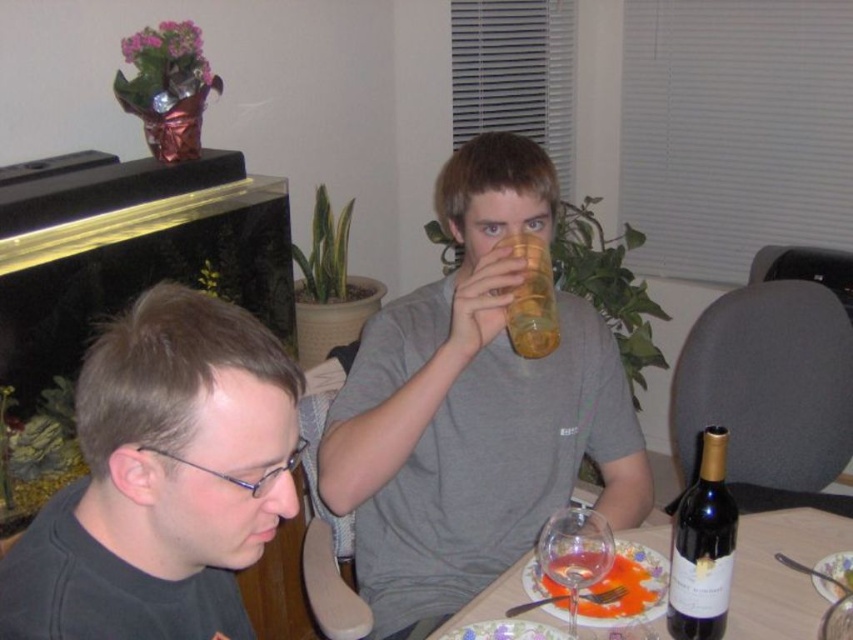
You are a waiter in this scene. You need to place a new menu at a specific location. The menu must be placed exactly at point (x=701, y=547). However, there is already an object at that location. What object will the menu cover?

The menu will cover the dark glass wine bottle at lower right because the point (x=701, y=547) is on it.

You are a guest at this dinner and need to place a small napkin between the black matte glasses at center and the translucent plastic cup at upper center. Which object should you move to make space?

Since the black matte glasses at center is wider than the translucent plastic cup at upper center, you should move the black matte glasses at center to create more space for the napkin.

You are a waiter in a restaurant and need to place a new drink order on the table. The customer specified they want the drink placed to the right of the black matte glasses at center. Where should you place the drink relative to the translucent plastic cup at upper center?

The black matte glasses at center is to the left of the translucent plastic cup at upper center, so placing the drink to the right of the black matte glasses at center would position it directly under or near the translucent plastic cup at upper center.